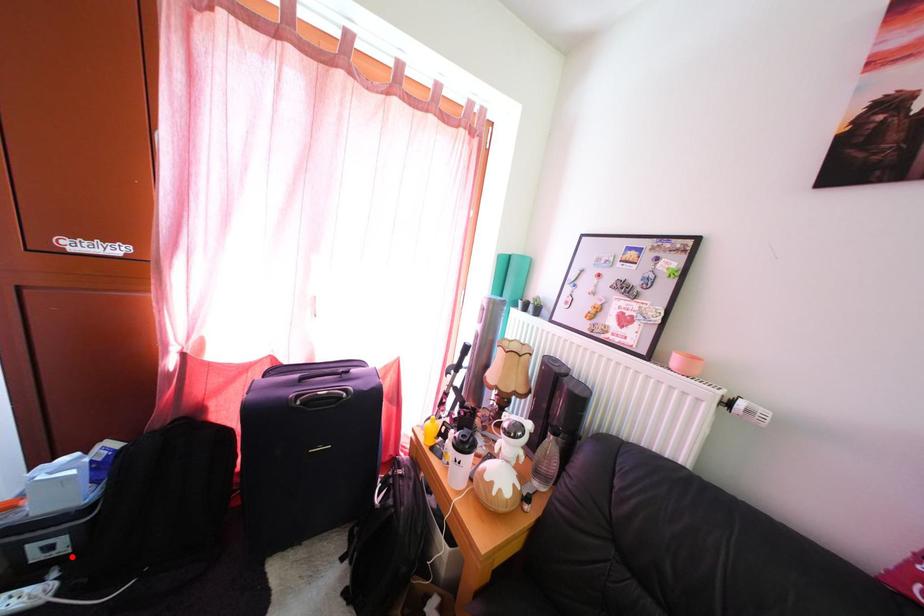
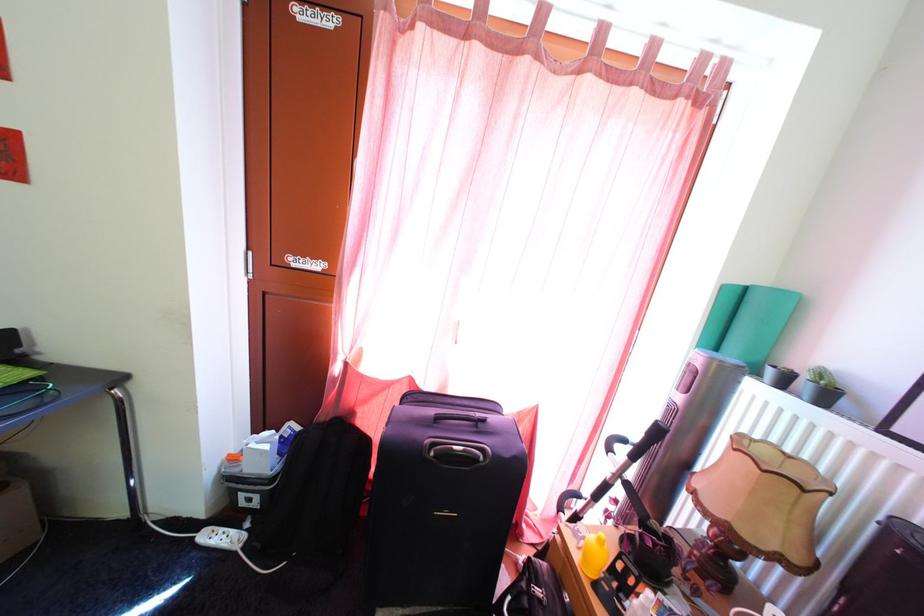
Question: A red point is marked in image1. In image2, is the corresponding 3D point closer to the camera or farther? Reply with the corresponding letter.

Choices:
 (A) The corresponding 3D point is closer.
 (B) The corresponding 3D point is farther.

Answer: (B)